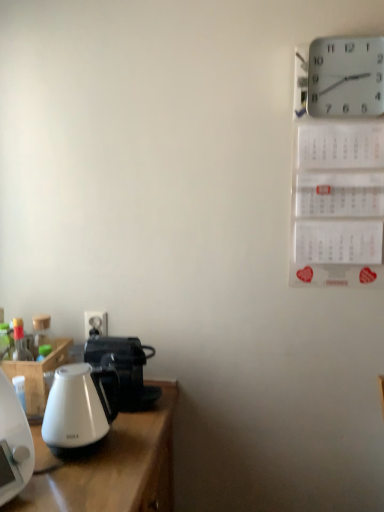
This screenshot has width=384, height=512. Find the location of `white glossy coffee pot at lower left`. white glossy coffee pot at lower left is located at coordinates (124, 369).

This screenshot has width=384, height=512. What are the coordinates of `white glossy kettle at left` in the screenshot? It's located at (80, 408).

Identify the location of white plastic electric outlet at lower left. This screenshot has height=512, width=384. (96, 323).

Describe the element at coordinates (346, 77) in the screenshot. This screenshot has height=512, width=384. I see `white plastic wall clock at upper right` at that location.

The image size is (384, 512). Find the location of `white glossy coffee pot at lower left`. white glossy coffee pot at lower left is located at coordinates (124, 369).

This screenshot has width=384, height=512. Identify the location of kettle in front of the white glossy coffee pot at lower left. (80, 408).

Considering the points (61, 419) and (151, 348), which point is behind, point (61, 419) or point (151, 348)?

The point (151, 348) is behind.

Is white glossy kettle at left bigger than white glossy coffee pot at lower left?

Incorrect, white glossy kettle at left is not larger than white glossy coffee pot at lower left.

Is white glossy kettle at left facing away from white glossy coffee pot at lower left?

No, white glossy kettle at left is not facing away from white glossy coffee pot at lower left.

From a real-world perspective, is white glossy kettle at left physically located above or below white plastic electric outlet at lower left?

Clearly, from a real-world perspective, white glossy kettle at left is below white plastic electric outlet at lower left.

Does white glossy kettle at left have a lesser height compared to white plastic electric outlet at lower left?

Incorrect, the height of white glossy kettle at left does not fall short of that of white plastic electric outlet at lower left.

At what (x,y) coordinates should I click in order to perform the action: click on electric outlet that is behind the white glossy kettle at left. Please return your answer as a coordinate pair (x, y). The height and width of the screenshot is (512, 384). Looking at the image, I should click on (96, 323).

Can you confirm if white glossy kettle at left is positioned to the left of white plastic electric outlet at lower left?

No, white glossy kettle at left is not to the left of white plastic electric outlet at lower left.

Considering the sizes of objects white plastic electric outlet at lower left and white plastic wall clock at upper right in the image provided, who is smaller, white plastic electric outlet at lower left or white plastic wall clock at upper right?

white plastic electric outlet at lower left is smaller.

Could you measure the distance between white plastic electric outlet at lower left and white plastic wall clock at upper right?

white plastic electric outlet at lower left is 3.62 feet away from white plastic wall clock at upper right.

Considering the relative sizes of white plastic electric outlet at lower left and white plastic wall clock at upper right in the image provided, is white plastic electric outlet at lower left wider than white plastic wall clock at upper right?

No.

From a real-world perspective, between white plastic electric outlet at lower left and white plastic wall clock at upper right, who is vertically higher?

In real-world perspective, white plastic wall clock at upper right is above.

Does white glossy coffee pot at lower left appear on the right side of white plastic wall clock at upper right?

Incorrect, white glossy coffee pot at lower left is not on the right side of white plastic wall clock at upper right.

Considering the sizes of objects white glossy coffee pot at lower left and white plastic wall clock at upper right in the image provided, who is thinner, white glossy coffee pot at lower left or white plastic wall clock at upper right?

white plastic wall clock at upper right is thinner.

Which object is further away from the camera taking this photo, white glossy coffee pot at lower left or white plastic wall clock at upper right?

white glossy coffee pot at lower left is behind.

From a real-world perspective, which object stands above the other?

In real-world perspective, white plastic wall clock at upper right is above.

From a real-world perspective, which is physically above, white plastic wall clock at upper right or white plastic electric outlet at lower left?

white plastic wall clock at upper right is physically above.

Does white plastic wall clock at upper right have a larger size compared to white plastic electric outlet at lower left?

Correct, white plastic wall clock at upper right is larger in size than white plastic electric outlet at lower left.

How far apart are white plastic wall clock at upper right and white plastic electric outlet at lower left?

white plastic wall clock at upper right and white plastic electric outlet at lower left are 1.10 meters apart.

Is white plastic wall clock at upper right wider or thinner than white plastic electric outlet at lower left?

In the image, white plastic wall clock at upper right appears to be wider than white plastic electric outlet at lower left.

Would you say white glossy kettle at left is part of white plastic electric outlet at lower left's contents?

No, white glossy kettle at left is not surrounded by white plastic electric outlet at lower left.

Consider the image. Can you confirm if white plastic electric outlet at lower left is thinner than white glossy kettle at left?

Yes, white plastic electric outlet at lower left is thinner than white glossy kettle at left.

Considering the points (97, 322) and (66, 426), which point is behind, point (97, 322) or point (66, 426)?

The point (97, 322) is farther.

Based on the photo, in the image, is white plastic electric outlet at lower left positioned in front of or behind white glossy kettle at left?

Visually, white plastic electric outlet at lower left is located behind white glossy kettle at left.

Does point (159, 396) lie behind point (106, 370)?

Yes, point (159, 396) is behind point (106, 370).

From the picture: How different are the orientations of white glossy coffee pot at lower left and white glossy kettle at left in degrees?

The angular difference between white glossy coffee pot at lower left and white glossy kettle at left is 2.68 degrees.

Are white glossy coffee pot at lower left and white glossy kettle at left far apart?

white glossy coffee pot at lower left is near white glossy kettle at left, not far away.

Can we say white glossy coffee pot at lower left lies outside white glossy kettle at left?

Absolutely, white glossy coffee pot at lower left is external to white glossy kettle at left.

Locate an element on the screen. The width and height of the screenshot is (384, 512). coffeepot located on the right of white glossy kettle at left is located at coordinates (124, 369).

The height and width of the screenshot is (512, 384). I want to click on electric outlet above the white glossy kettle at left (from the image's perspective), so click(96, 323).

Considering their positions, is white plastic wall clock at upper right positioned closer to white glossy kettle at left than white glossy coffee pot at lower left?

white glossy coffee pot at lower left is closer to white glossy kettle at left.

From the image, which object appears to be nearer to white plastic wall clock at upper right, white glossy kettle at left or white plastic electric outlet at lower left?

white plastic electric outlet at lower left is closer to white plastic wall clock at upper right.

Based on their spatial positions, is white plastic electric outlet at lower left or white glossy kettle at left closer to white plastic wall clock at upper right?

white plastic electric outlet at lower left lies closer to white plastic wall clock at upper right than the other object.

Consider the image. Which object lies nearer to the anchor point white glossy kettle at left, white glossy coffee pot at lower left or white plastic wall clock at upper right?

white glossy coffee pot at lower left.

Based on their spatial positions, is white glossy coffee pot at lower left or white plastic electric outlet at lower left closer to white plastic wall clock at upper right?

white glossy coffee pot at lower left is positioned closer to the anchor white plastic wall clock at upper right.

Which object lies nearer to the anchor point white plastic electric outlet at lower left, white glossy kettle at left or white glossy coffee pot at lower left?

white glossy coffee pot at lower left is closer to white plastic electric outlet at lower left.

When comparing their distances from white glossy kettle at left, does white plastic electric outlet at lower left or white glossy coffee pot at lower left seem further?

Based on the image, white plastic electric outlet at lower left appears to be further to white glossy kettle at left.

Considering their positions, is white plastic electric outlet at lower left positioned closer to white glossy coffee pot at lower left than white plastic wall clock at upper right?

white plastic electric outlet at lower left.

At what (x,y) coordinates should I click in order to perform the action: click on electric outlet between white plastic wall clock at upper right and white glossy coffee pot at lower left in the vertical direction. Please return your answer as a coordinate pair (x, y). Image resolution: width=384 pixels, height=512 pixels. Looking at the image, I should click on (96, 323).

You are a GUI agent. You are given a task and a screenshot of the screen. Output one action in this format:
    pyautogui.click(x=<x>, y=<y>)
    Task: Click on the electric outlet between white plastic wall clock at upper right and white glossy kettle at left vertically
    The height and width of the screenshot is (512, 384).
    Given the screenshot: What is the action you would take?
    pyautogui.click(x=96, y=323)

This screenshot has width=384, height=512. I want to click on coffeepot between white glossy kettle at left and white plastic electric outlet at lower left along the z-axis, so click(124, 369).

This screenshot has height=512, width=384. What are the coordinates of `coffeepot that lies between white plastic wall clock at upper right and white glossy kettle at left from top to bottom` in the screenshot? It's located at (124, 369).